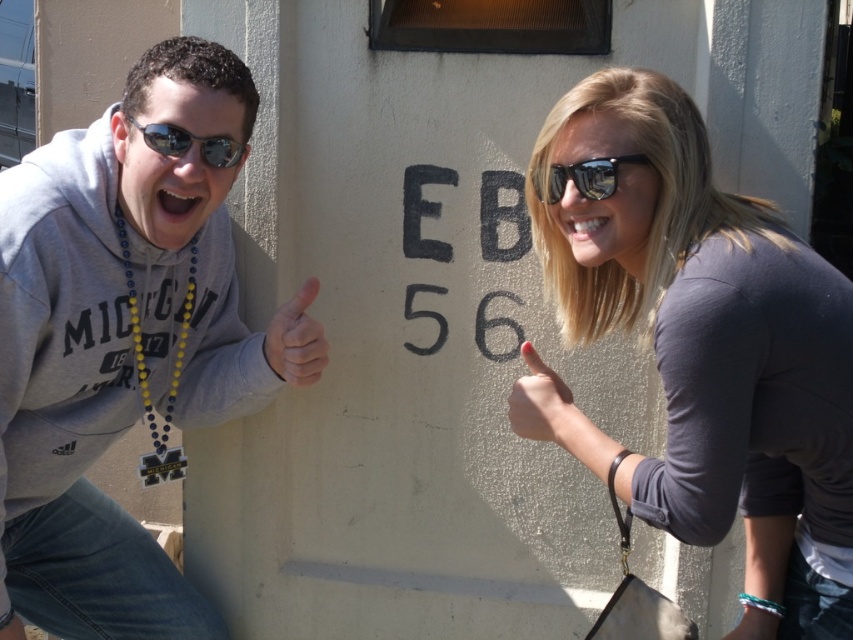
You are a photographer who wants to capture a photo of the gray sweatshirt at left and the matte gray shirt at right. Based on their positions, which one is lower in the frame?

The gray sweatshirt at left is below matte gray shirt at right, so the gray sweatshirt at left is lower in the frame.